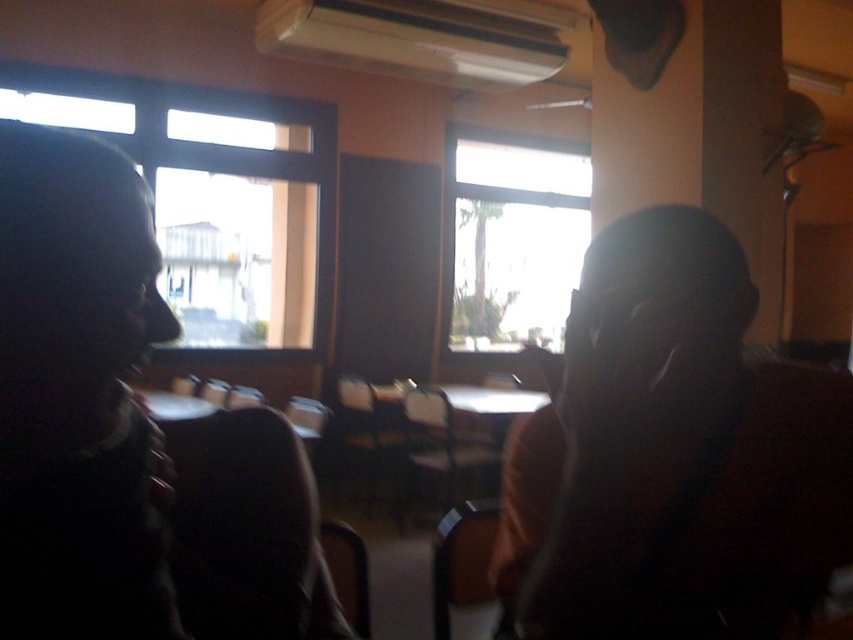
You are standing in the room depicted in the image. If you want to look outside through the transparent glass window at left, which direction should you face?

You should face towards the left side of the room to look outside through the transparent glass window at left since its 2D location is at point 0.311 on the x axis, which is the left side of the room.

You are an interior designer planning to install a new set of curtains in the room. The left transparent glass window at left and the center transparent glass window at center both require curtains. Since the windows are different in height, which window will require longer curtains to cover the entire height?

The transparent glass window at left is taller than the transparent glass window at center, so the left window will require longer curtains to cover its entire height.